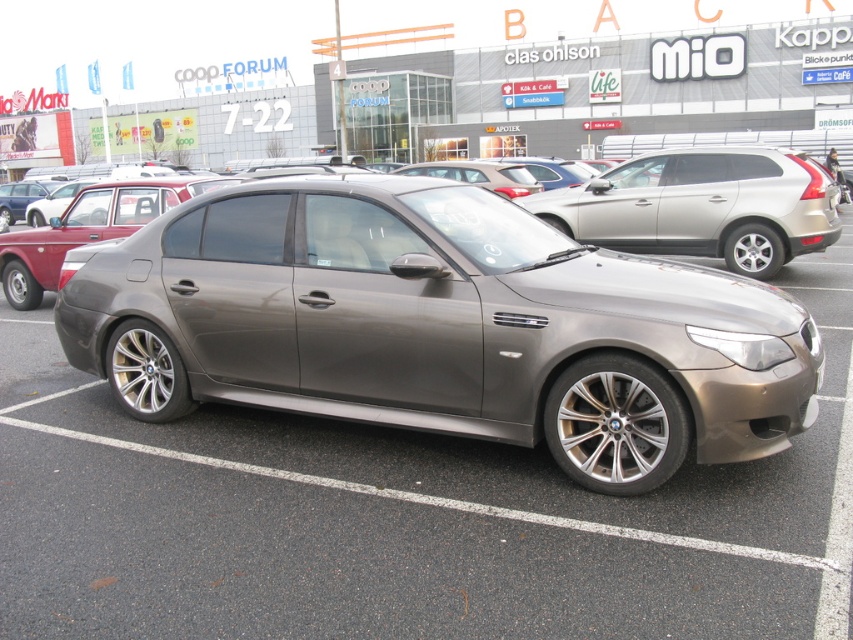
You are standing in the parking lot looking at the BMW sedan. There are two points marked on the car. One is at coordinate point (x=395, y=548) and the other at point (x=746, y=253). Which point is closer to you?

The point at (x=395, y=548) is closer to you than the point at (x=746, y=253).

You are standing in the parking lot looking at the BMW sedan. There are two points marked on the car, one at coordinates point (648, 419) and the other at point (412, 163). Which of these points is closer to you?

Point (648, 419) is closer to the viewer than point (412, 163).

You are a delivery person trying to unload a package from the trunk of your car. You need to know which car is closer to you. Which car is positioned lower between the satin silver car at center and the satin metallic car at center?

The satin silver car at center is positioned under the satin metallic car at center, so the satin silver car at center is lower and closer to you.